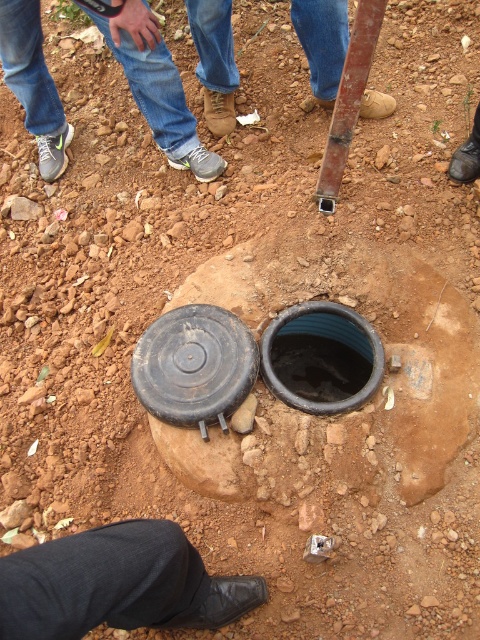
Looking at this image, does black leather shoe at lower center appear under black rubber manhole at center?

Yes.

Who is more forward, (237, 579) or (344, 400)?

Point (237, 579) is more forward.

Identify the location of black leather shoe at lower center. The height and width of the screenshot is (640, 480). (118, 582).

Can you confirm if black leather shoe at lower center is taller than brown leather boots at center?

Correct, black leather shoe at lower center is much taller as brown leather boots at center.

Is black leather shoe at lower center further to the viewer compared to brown leather boots at center?

No, black leather shoe at lower center is in front of brown leather boots at center.

Measure the distance between black leather shoe at lower center and camera.

A distance of 35.77 inches exists between black leather shoe at lower center and camera.

You are a GUI agent. You are given a task and a screenshot of the screen. Output one action in this format:
    pyautogui.click(x=<x>, y=<y>)
    Task: Click on the black leather shoe at lower center
    This screenshot has height=640, width=480.
    Given the screenshot: What is the action you would take?
    118,582

Is black leather shoe at lower center smaller than gray fabric shoe at lower left?

Yes, black leather shoe at lower center is smaller than gray fabric shoe at lower left.

Between point (106, 573) and point (121, 45), which one is positioned behind?

Point (121, 45)

Which is in front, point (82, 538) or point (140, 84)?

Point (82, 538)

At what (x,y) coordinates should I click in order to perform the action: click on black leather shoe at lower center. Please return your answer as a coordinate pair (x, y). This screenshot has height=640, width=480. Looking at the image, I should click on (118, 582).